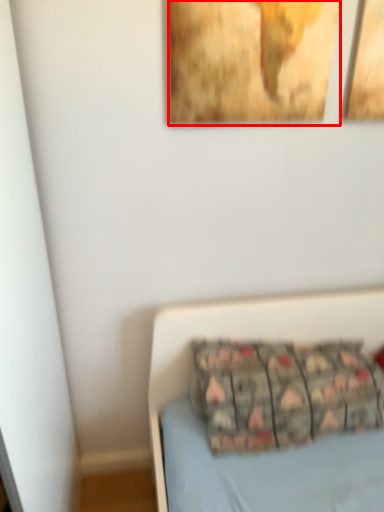
Question: From the image, what is the correct spatial relationship of picture frame (annotated by the red box) in relation to pillow?

Choices:
 (A) right
 (B) left

Answer: (B)